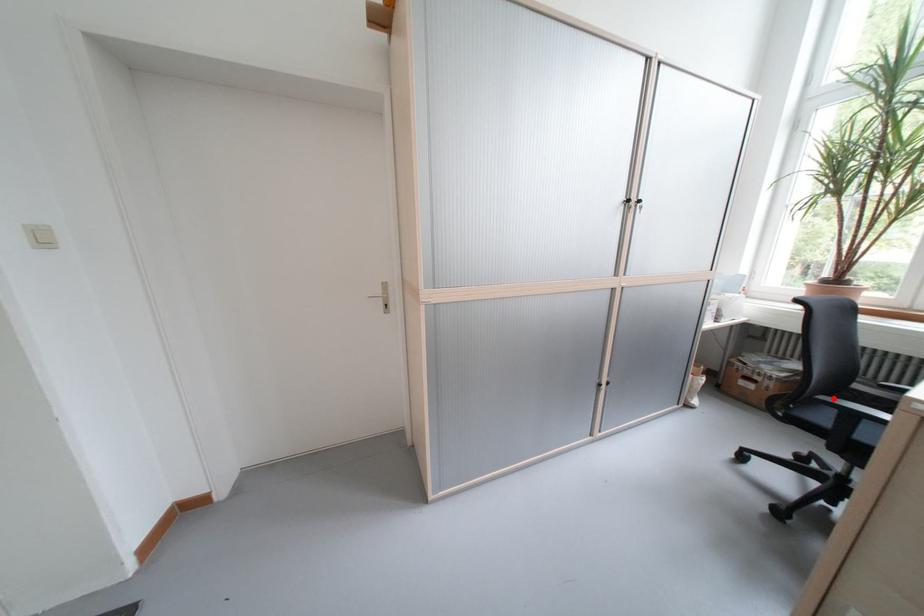
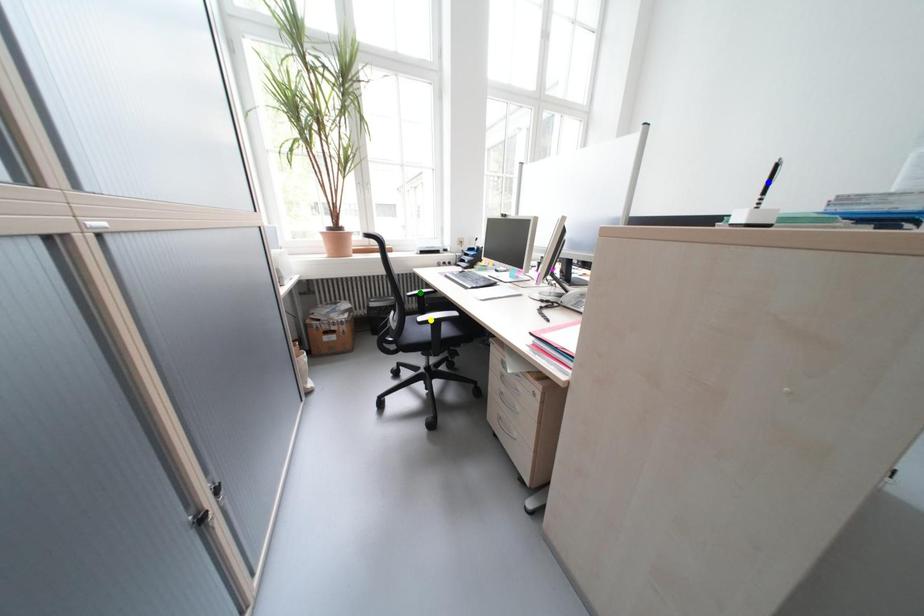
Question: I am providing you with two images of the same scene from different viewpoints. A red point is marked on the first image. You are given multiple points on the second image. Which point in image 2 represents the same 3d spot as the red point in image 1?

Choices:
 (A) blue point
 (B) yellow point
 (C) green point

Answer: (B)